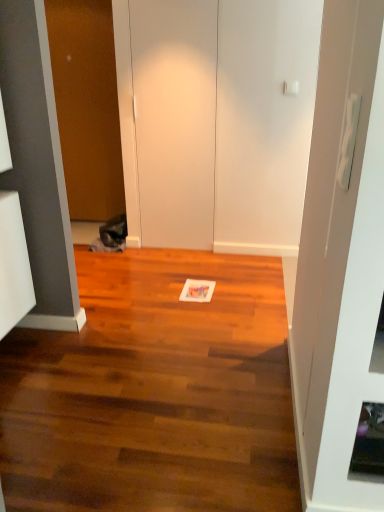
Identify the location of vacant area situated to the left side of white matte door at center, the second door positioned from the left. Image resolution: width=384 pixels, height=512 pixels. (137, 255).